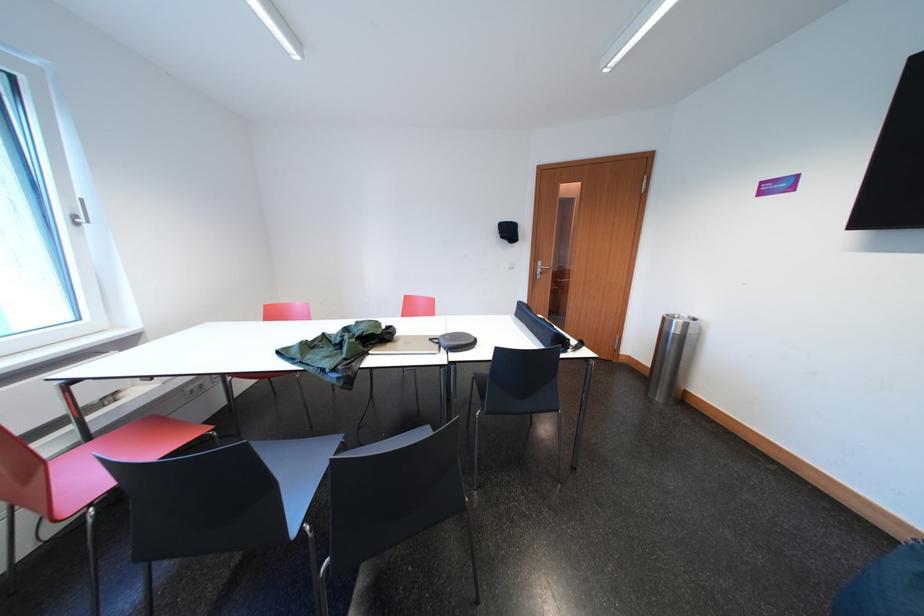
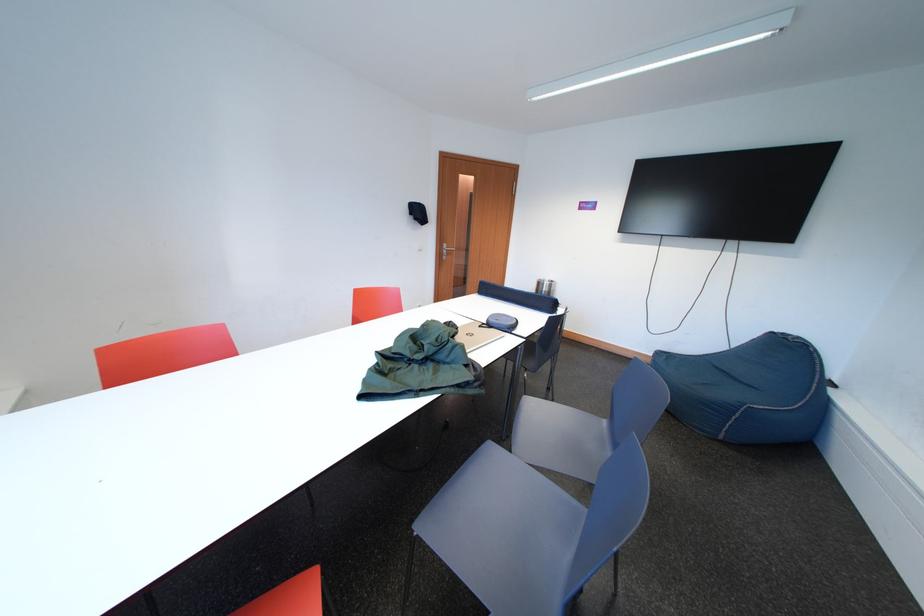
The point at [441,344] is marked in the first image. Where is the corresponding point in the second image?

(490, 330)